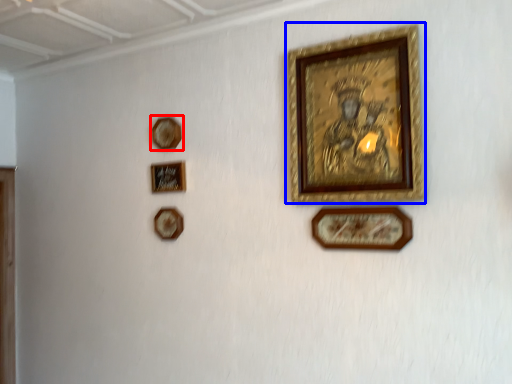
Question: Which object is further to the camera taking this photo, picture frame (highlighted by a red box) or picture frame (highlighted by a blue box)?

Choices:
 (A) picture frame
 (B) picture frame

Answer: (A)